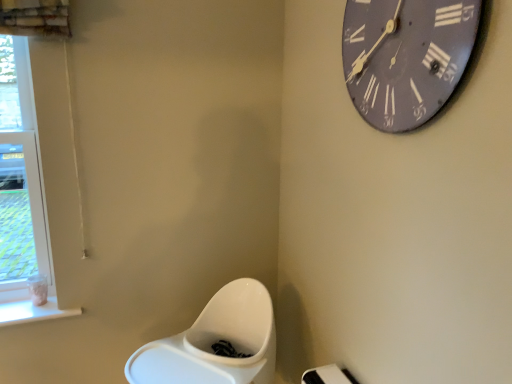
Question: Considering the relative positions of clear glass window at left and matte gray clock at upper right in the image provided, is clear glass window at left in front of matte gray clock at upper right?

Choices:
 (A) yes
 (B) no

Answer: (B)

Question: From a real-world perspective, is clear glass window at left positioned under matte gray clock at upper right based on gravity?

Choices:
 (A) no
 (B) yes

Answer: (B)

Question: Does clear glass window at left have a greater height compared to matte gray clock at upper right?

Choices:
 (A) no
 (B) yes

Answer: (B)

Question: Is clear glass window at left positioned far away from matte gray clock at upper right?

Choices:
 (A) no
 (B) yes

Answer: (B)

Question: Can you confirm if clear glass window at left is positioned to the right of matte gray clock at upper right?

Choices:
 (A) yes
 (B) no

Answer: (B)

Question: Is clear glass window at left facing away from matte gray clock at upper right?

Choices:
 (A) yes
 (B) no

Answer: (B)

Question: Is matte gray clock at upper right in front of clear glass window at left?

Choices:
 (A) no
 (B) yes

Answer: (B)

Question: Is matte gray clock at upper right smaller than clear glass window at left?

Choices:
 (A) no
 (B) yes

Answer: (B)

Question: Is matte gray clock at upper right at the left side of clear glass window at left?

Choices:
 (A) no
 (B) yes

Answer: (A)

Question: Can you confirm if matte gray clock at upper right is thinner than clear glass window at left?

Choices:
 (A) no
 (B) yes

Answer: (B)

Question: Is matte gray clock at upper right outside of clear glass window at left?

Choices:
 (A) yes
 (B) no

Answer: (A)

Question: From the image's perspective, is matte gray clock at upper right beneath clear glass window at left?

Choices:
 (A) yes
 (B) no

Answer: (B)

Question: Looking at their shapes, would you say matte gray clock at upper right is wider or thinner than clear glass window at left?

Choices:
 (A) wide
 (B) thin

Answer: (B)